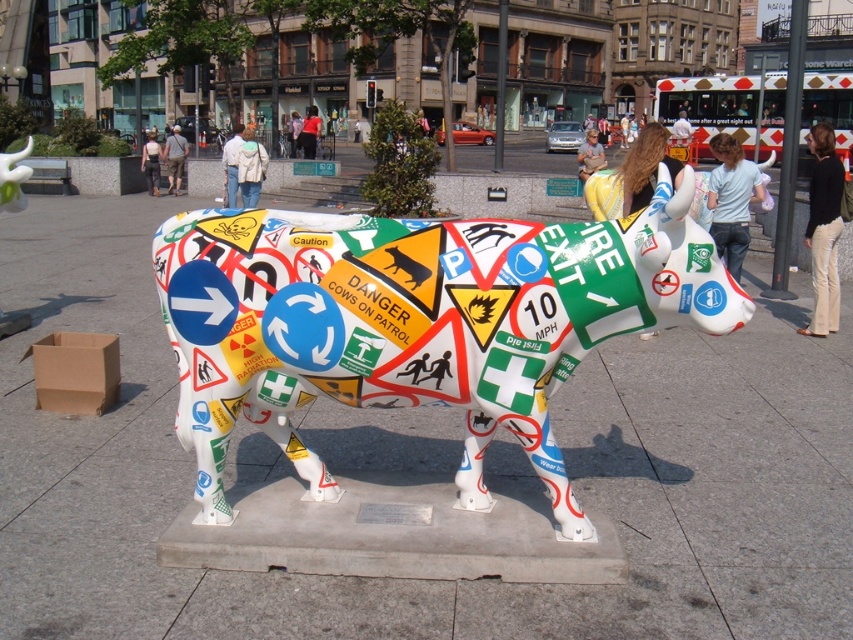
You are standing in the public square and want to take a photo of the white glossy cow at center. If you are positioned at point A, which is at coordinates 0.450, 0.450, can you directly see the cow without any obstructions?

The white glossy cow at center is located at point [416,323]. Since your position at [383,288] is close and there are no mentioned obstructions in the scene description, you can directly see the cow.